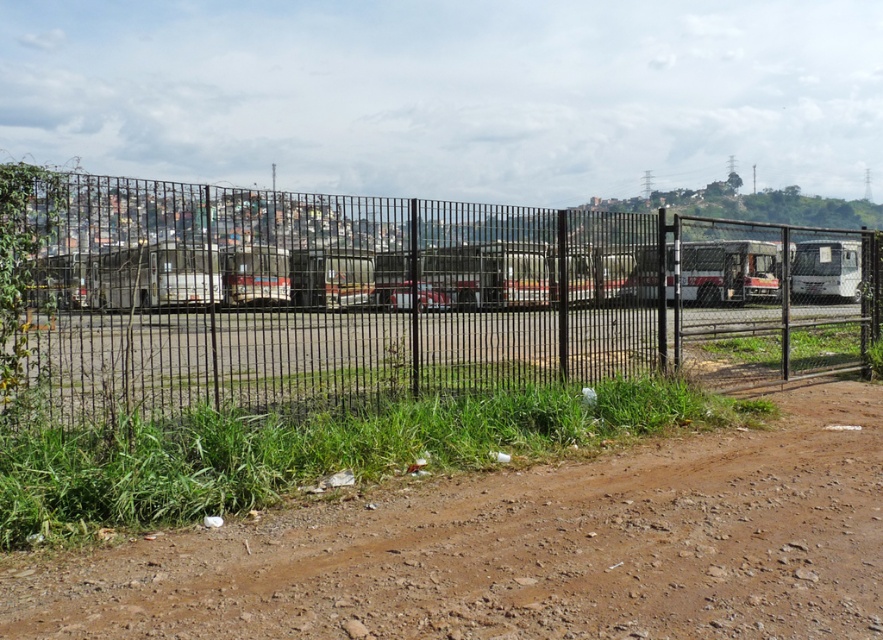
You are standing on the brown dirt field at lower left and want to reach the buses parked behind the black metal fence at center. Which direction should you walk to get closer to the fence?

You should walk towards the black metal fence at center since it is above the brown dirt field at lower left, meaning it is in a higher position, so moving towards it would be the correct direction.

You are standing on the brown dirt field at lower left and want to see the buses parked behind the black metal fence at center. Can you see the buses clearly over the fence?

The black metal fence at center is taller than the brown dirt field at lower left, so you might not be able to see the buses clearly over the fence.

From the picture: You are a delivery person trying to enter the fenced area. The black metal fence at center has a gate that is as wide as the brown dirt field at lower left. Can you pass through the gate with your delivery truck that is 2 meters wide?

The black metal fence at center might be wider than brown dirt field at lower left, so the gate width is at least as wide as the dirt field. Since the truck is 2 meters wide, if the dirt field is wider than or equal to 2 meters, the truck can pass. However, since the exact width of the dirt field isn